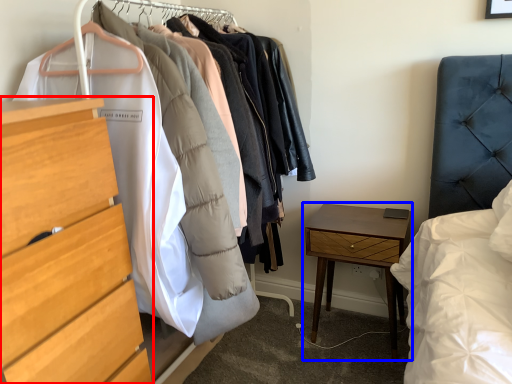
Question: Among these objects, which one is farthest to the camera, chest of drawers (highlighted by a red box) or nightstand (highlighted by a blue box)?

Choices:
 (A) chest of drawers
 (B) nightstand

Answer: (B)